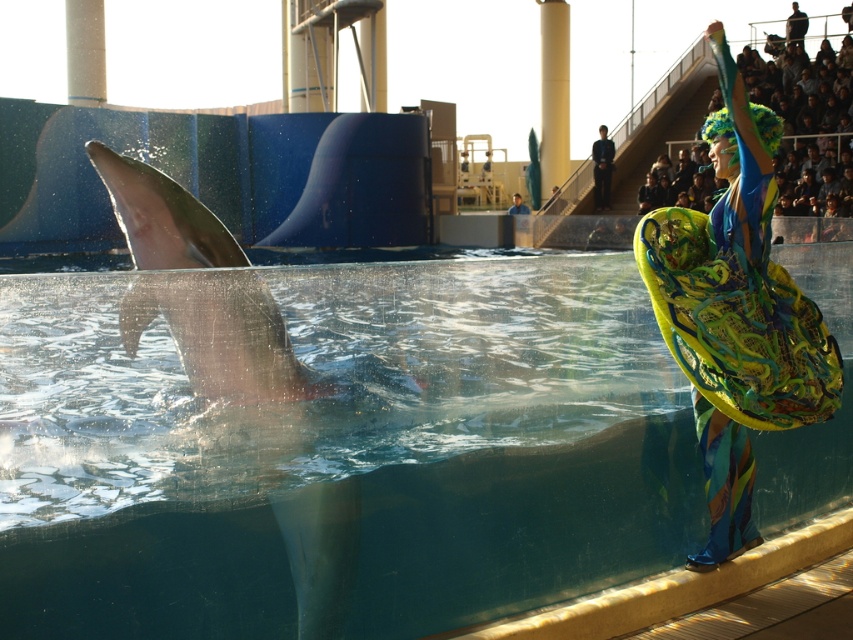
You are a photographer at the marine park. You need to capture a photo that includes both the smooth gray dolphin at left and the black smooth suit at upper center. Based on their positions, which object should you place on the left side of your photo frame?

The smooth gray dolphin at left should be placed on the left side of your photo frame because it is positioned on the left side of the black smooth suit at upper center.

You are a photographer at the marine park and want to capture the multicolored fabric fan at right in your shot. The camera is positioned at the point with coordinates point (735, 314). Where should you aim the camera to include both the dolphin and the multicolored fabric fan at right in the frame?

The point (735, 314) marks the location of the multicolored fabric fan at right. To include both the dolphin and the fan in the frame, the photographer should position the camera to capture the area around the fan while ensuring the dolphin in the foreground is within the shot.